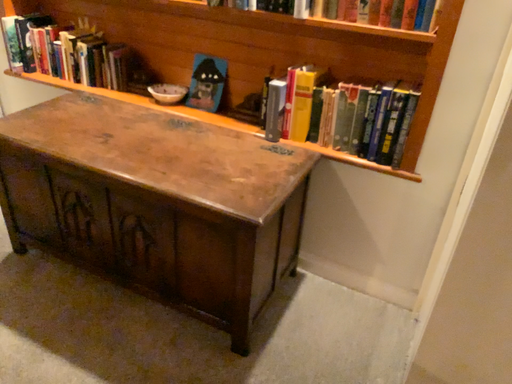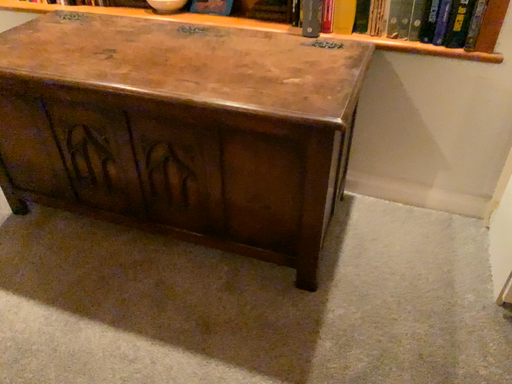
Question: Which way did the camera rotate in the video?

Choices:
 (A) rotated upward
 (B) rotated downward

Answer: (B)